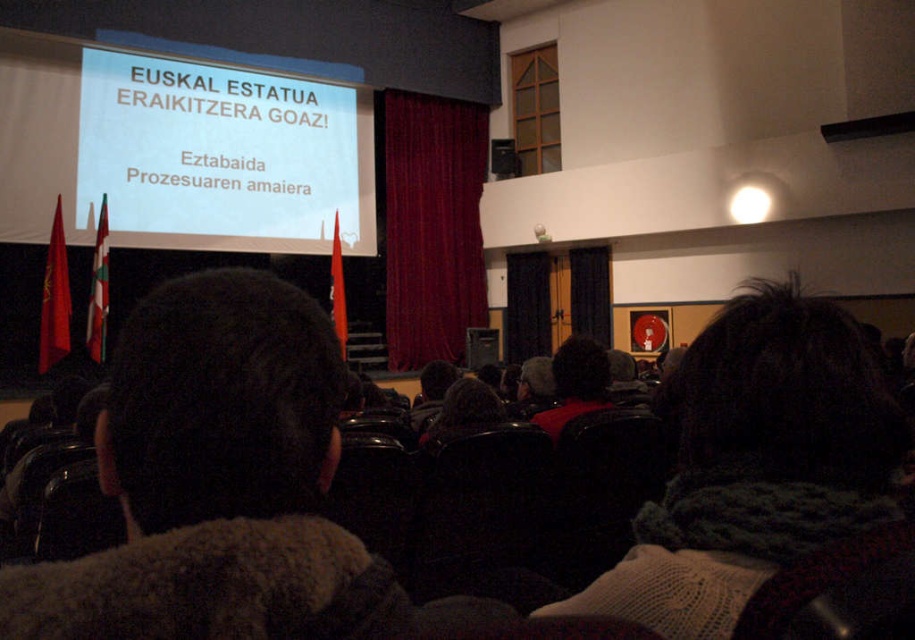
Question: Is dark brown fur coat at center closer to the viewer compared to black fabric curtain at center?

Choices:
 (A) yes
 (B) no

Answer: (A)

Question: Where is knitted scarf at center located in relation to black fabric curtain at center in the image?

Choices:
 (A) below
 (B) above

Answer: (A)

Question: Which point is closer to the camera taking this photo?

Choices:
 (A) (601, 276)
 (B) (289, 588)
 (C) (395, 170)
 (D) (555, 432)

Answer: (B)

Question: Which point is closer to the camera taking this photo?

Choices:
 (A) pyautogui.click(x=749, y=416)
 (B) pyautogui.click(x=309, y=218)
 (C) pyautogui.click(x=483, y=176)
 (D) pyautogui.click(x=558, y=362)

Answer: (A)

Question: Which object is the farthest from the velvet red curtain at center?

Choices:
 (A) black fabric curtain at center
 (B) knitted scarf at center
 (C) dark brown hair at center

Answer: (B)

Question: Is white glossy projector screen at upper center wider than velvet red curtain at center?

Choices:
 (A) no
 (B) yes

Answer: (B)